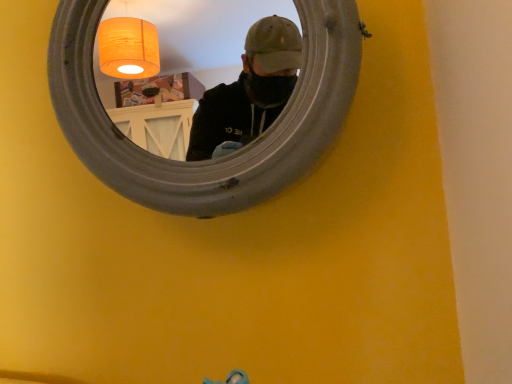
This screenshot has width=512, height=384. Describe the element at coordinates (209, 161) in the screenshot. I see `rustic wood mirror at upper center` at that location.

The height and width of the screenshot is (384, 512). In order to click on rustic wood mirror at upper center in this screenshot , I will do `click(209, 161)`.

Where is `rustic wood mirror at upper center`? The width and height of the screenshot is (512, 384). rustic wood mirror at upper center is located at coordinates (209, 161).